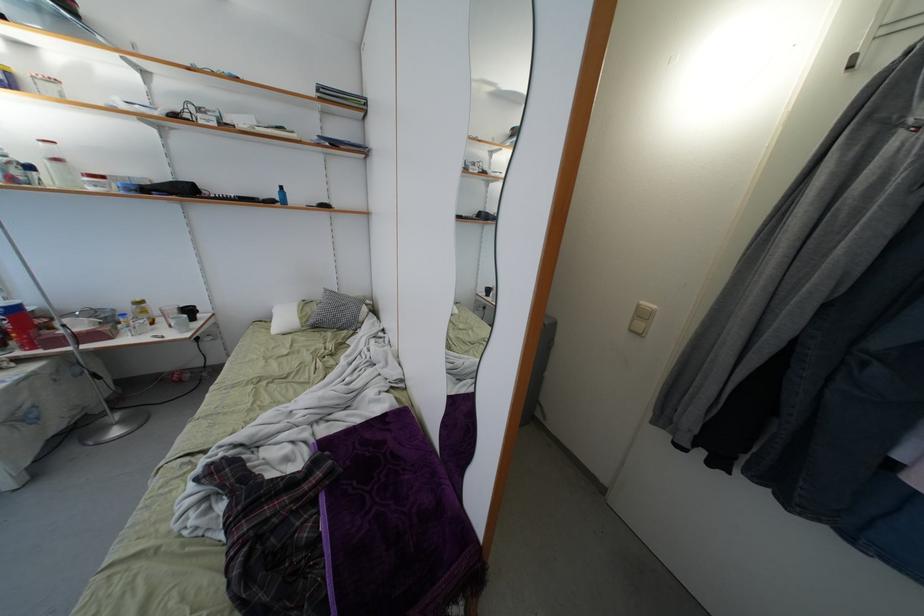
Where is `light switch button`? light switch button is located at coordinates (641, 318).